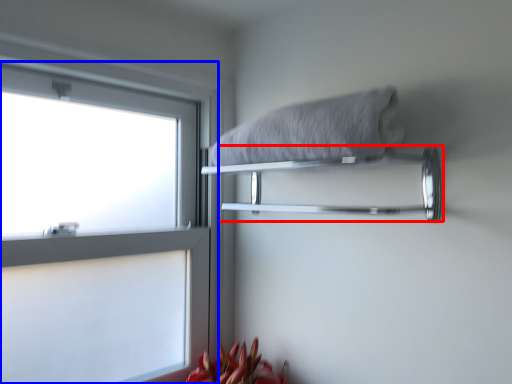
Question: Which object appears closest to the camera in this image, towel bar (highlighted by a red box) or window (highlighted by a blue box)?

Choices:
 (A) towel bar
 (B) window

Answer: (A)